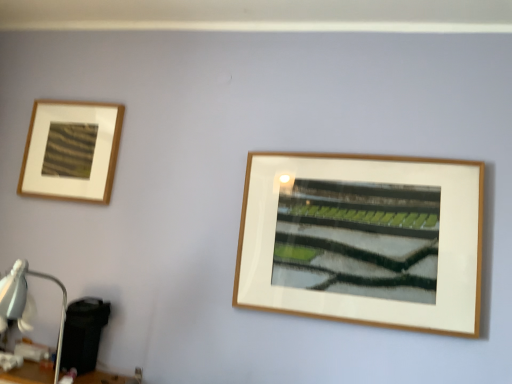
Question: From the image's perspective, does matte wood picture frame at upper left appear higher than matte white table lamp at lower left?

Choices:
 (A) yes
 (B) no

Answer: (A)

Question: Are matte wood picture frame at upper left and matte white table lamp at lower left far apart?

Choices:
 (A) yes
 (B) no

Answer: (B)

Question: From a real-world perspective, does matte wood picture frame at upper left stand above matte white table lamp at lower left?

Choices:
 (A) yes
 (B) no

Answer: (A)

Question: Is matte wood picture frame at upper left in contact with matte white table lamp at lower left?

Choices:
 (A) no
 (B) yes

Answer: (A)

Question: Is matte wood picture frame at upper left not inside matte white table lamp at lower left?

Choices:
 (A) yes
 (B) no

Answer: (A)

Question: Is point (32, 370) closer or farther from the camera than point (40, 183)?

Choices:
 (A) farther
 (B) closer

Answer: (B)

Question: Would you say wooden table at lower left is to the left or to the right of matte wood picture frame at upper left in the picture?

Choices:
 (A) left
 (B) right

Answer: (B)

Question: Considering the positions of wooden table at lower left and matte wood picture frame at upper left in the image, is wooden table at lower left wider or thinner than matte wood picture frame at upper left?

Choices:
 (A) thin
 (B) wide

Answer: (B)

Question: In the image, is wooden table at lower left positioned in front of or behind matte wood picture frame at upper left?

Choices:
 (A) front
 (B) behind

Answer: (A)

Question: From a real-world perspective, is wooden table at lower left above or below matte white table lamp at lower left?

Choices:
 (A) above
 (B) below

Answer: (B)

Question: From the image's perspective, is wooden table at lower left located above or below matte white table lamp at lower left?

Choices:
 (A) below
 (B) above

Answer: (A)

Question: Considering the positions of wooden table at lower left and matte white table lamp at lower left in the image, is wooden table at lower left bigger or smaller than matte white table lamp at lower left?

Choices:
 (A) small
 (B) big

Answer: (A)

Question: In terms of width, does wooden table at lower left look wider or thinner when compared to matte white table lamp at lower left?

Choices:
 (A) thin
 (B) wide

Answer: (A)

Question: Is matte wood picture frame at upper left in front of or behind matte white table lamp at lower left in the image?

Choices:
 (A) behind
 (B) front

Answer: (A)

Question: Is matte wood picture frame at upper left wider or thinner than matte white table lamp at lower left?

Choices:
 (A) wide
 (B) thin

Answer: (B)